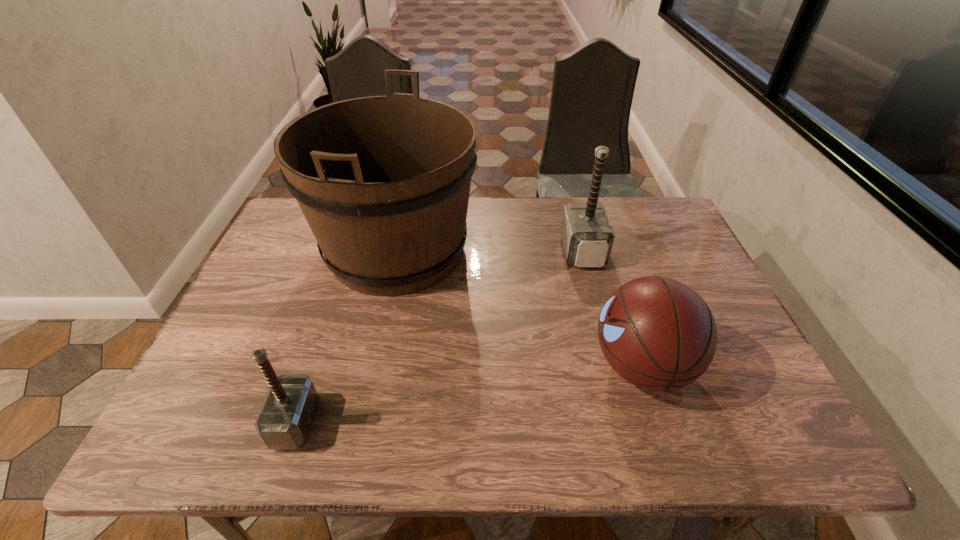
At what (x,y) coordinates should I click in order to perform the action: click on free space that satisfies the following two spatial constraints: 1. for striking with the head of the basketball; 2. on the left side of the third shortest object. Please return your answer as a coordinate pair (x, y). The height and width of the screenshot is (540, 960). Looking at the image, I should click on click(612, 366).